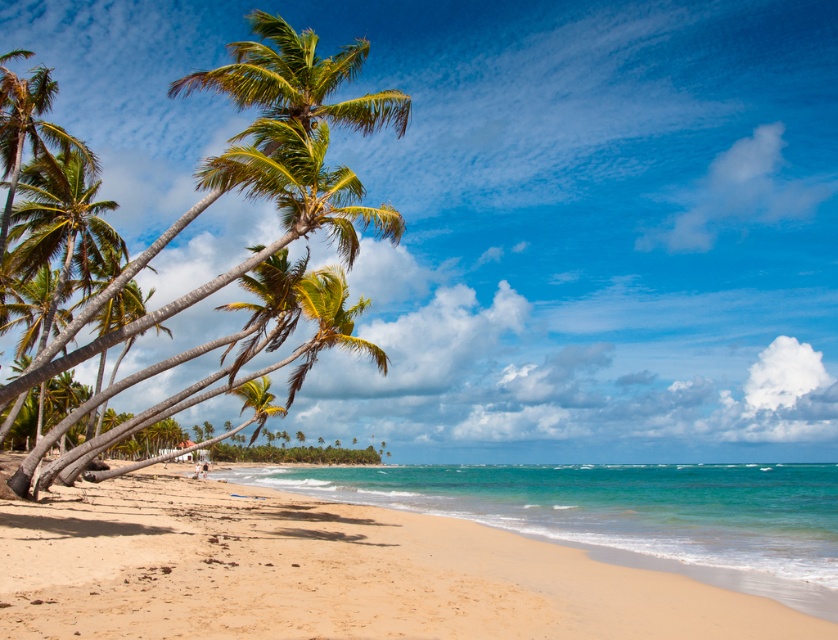
Can you confirm if sandy beach at lower left is positioned to the left of green leafy palm tree at left?

Incorrect, sandy beach at lower left is not on the left side of green leafy palm tree at left.

Is point (97, 497) positioned behind point (230, 72)?

Yes, it is.

Locate an element on the screen. sandy beach at lower left is located at coordinates (326, 572).

Does green leafy palm tree at left appear on the left side of green leafy palm tree at center?

Correct, you'll find green leafy palm tree at left to the left of green leafy palm tree at center.

Who is shorter, green leafy palm tree at left or green leafy palm tree at center?

With less height is green leafy palm tree at center.

Describe the element at coordinates (297, 80) in the screenshot. The width and height of the screenshot is (838, 640). I see `green leafy palm tree at left` at that location.

I want to click on green leafy palm tree at left, so click(x=297, y=80).

Is the position of sandy beach at lower left less distant than that of green leafy palm tree at center?

Yes, sandy beach at lower left is closer to the viewer.

Is sandy beach at lower left to the right of green leafy palm tree at center from the viewer's perspective?

Correct, you'll find sandy beach at lower left to the right of green leafy palm tree at center.

Which is in front, point (102, 484) or point (234, 388)?

Point (234, 388)

Locate an element on the screen. The width and height of the screenshot is (838, 640). sandy beach at lower left is located at coordinates (326, 572).